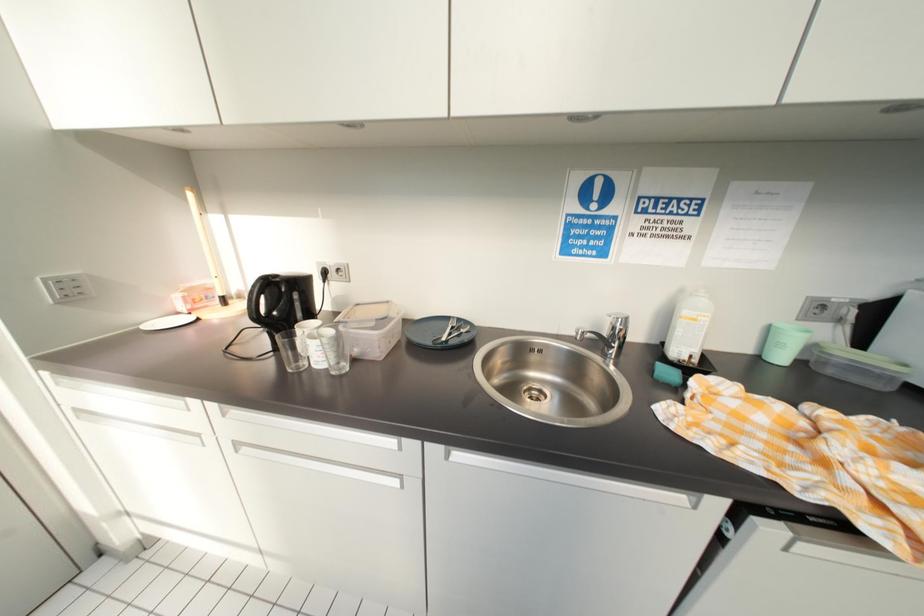
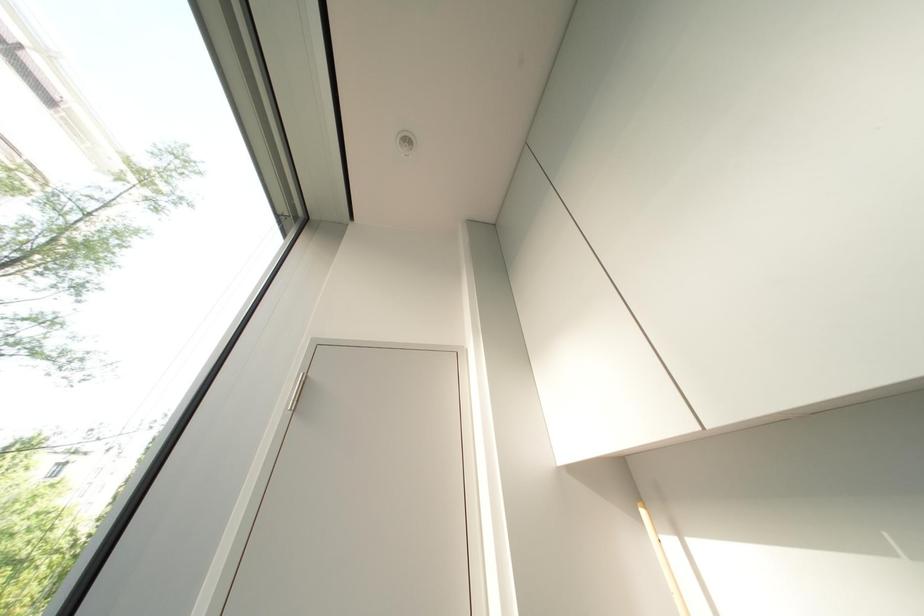
Consider the image. The images are taken continuously from a first-person perspective. In which direction is your viewpoint rotating?

The rotation direction of the camera is left-up.